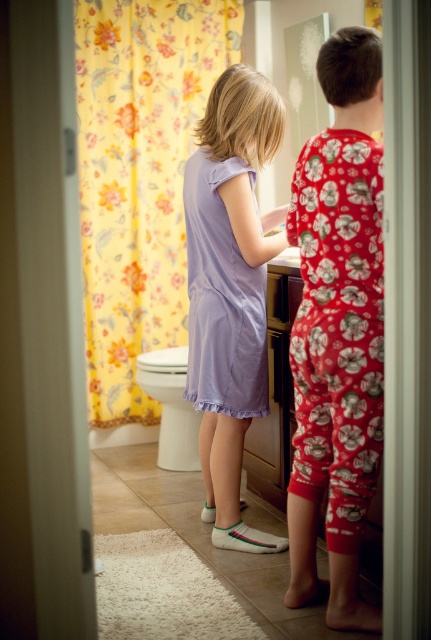
You are a parent trying to locate your child wearing the matte purple dress at center. From the bathroom doorway, where would you look relative to the yellow floral fabric at left?

A: The yellow floral fabric at left is located above the matte purple dress at center, so you should look below the yellow floral fabric at left to find the matte purple dress at center.

You are a parent trying to choose an outfit for your child. You see the matte purple dress at center and the lavender cotton dress at center in the bathroom. Which dress is shorter?

The matte purple dress at center is not as tall as lavender cotton dress at center, so the matte purple dress at center is shorter.

You are a parent trying to locate your child in the bathroom. You see the yellow floral fabric at left and the matte purple dress at center. Which object is higher up in the bathroom?

The yellow floral fabric at left is taller than the matte purple dress at center, so the yellow floral fabric at left is higher up in the bathroom.